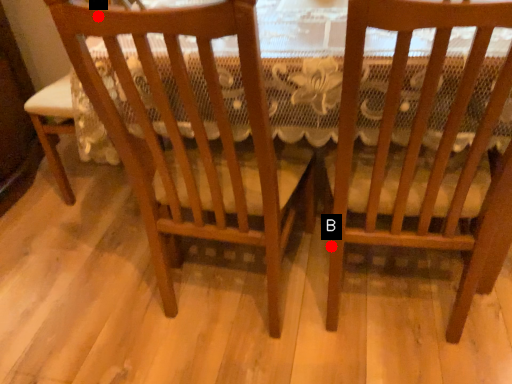
Question: Two points are circled on the image, labeled by A and B beside each circle. Among these points, which one is farthest from the camera?

Choices:
 (A) A is further
 (B) B is further

Answer: (B)